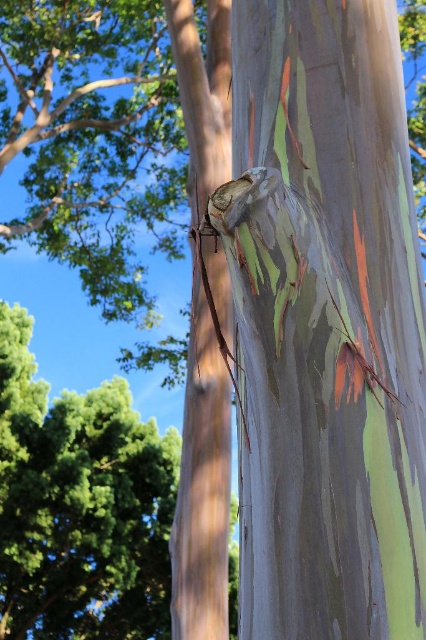
Between point (285, 6) and point (219, 632), which one is positioned behind?

The point (219, 632) is more distant.

Is multicolored bark tree trunk at center further to camera compared to smooth gray bark at center?

No, it is not.

Is point (308, 314) farther from camera compared to point (175, 58)?

No, (308, 314) is in front of (175, 58).

The width and height of the screenshot is (426, 640). What are the coordinates of `multicolored bark tree trunk at center` in the screenshot? It's located at (325, 323).